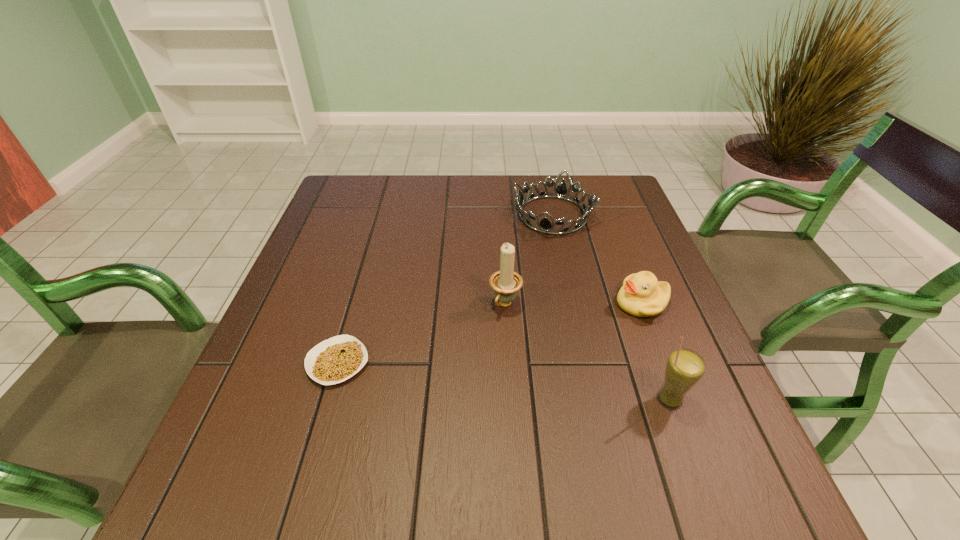
Where is `free spot located 0.240m at the face of the duckling`? The width and height of the screenshot is (960, 540). free spot located 0.240m at the face of the duckling is located at coordinates (534, 356).

Where is `vacant space located on the handle side of the second object from left to right`? vacant space located on the handle side of the second object from left to right is located at coordinates (445, 405).

This screenshot has width=960, height=540. In order to click on free space located 0.330m on the handle side of the second object from left to right in this screenshot , I will do `click(420, 447)`.

Image resolution: width=960 pixels, height=540 pixels. I want to click on vacant space located 0.100m on the handle side of the second object from left to right, so click(479, 350).

Locate an element on the screen. This screenshot has height=540, width=960. vacant area situated 0.060m on the front-facing side of the farthest object is located at coordinates (538, 251).

At what (x,y) coordinates should I click in order to perform the action: click on vacant region located on the front-facing side of the farthest object. Please return your answer as a coordinate pair (x, y). Looking at the image, I should click on (495, 343).

Find the location of a particular element. blank space located 0.160m on the front-facing side of the farthest object is located at coordinates (526, 274).

What are the coordinates of `object that is at the far edge` in the screenshot? It's located at (545, 225).

You are a GUI agent. You are given a task and a screenshot of the screen. Output one action in this format:
    pyautogui.click(x=<x>, y=<y>)
    Task: Click on the object that is at the near edge
    The image size is (960, 540).
    Given the screenshot: What is the action you would take?
    pyautogui.click(x=685, y=367)

Where is `object that is at the left edge`? This screenshot has width=960, height=540. object that is at the left edge is located at coordinates (334, 360).